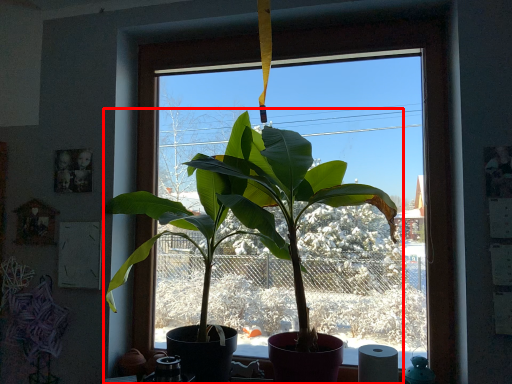
Question: Observing the image, what is the correct spatial positioning of houseplant (annotated by the red box) in reference to toilet paper?

Choices:
 (A) left
 (B) right

Answer: (A)